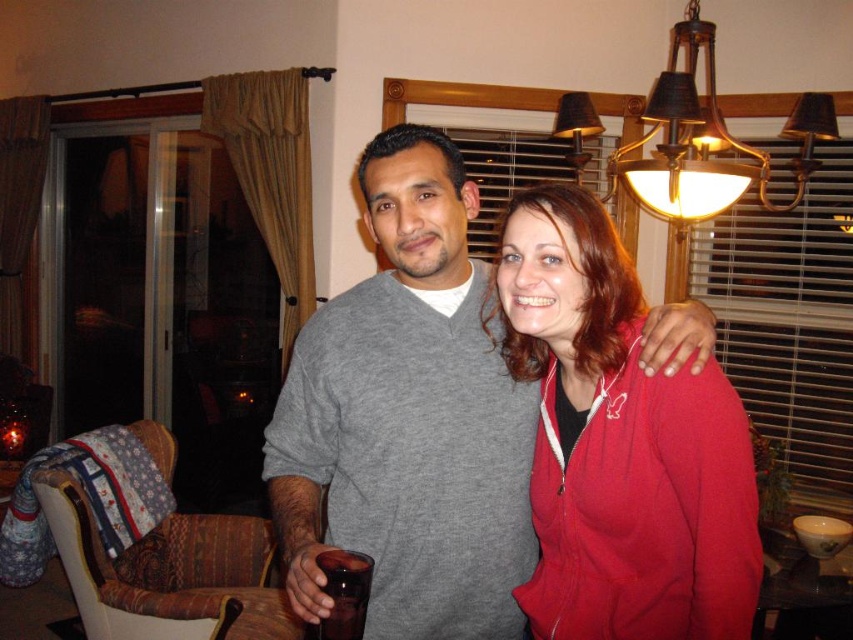
You are a delivery person standing in front of the gray matte sweater at center. The package you need to deliver must be placed exactly 3.5 feet away from the sweater. Can you place the package at the required distance?

The gray matte sweater at center is 3.49 feet from viewer, so placing the package exactly 3.5 feet away from it would require placing it approximately 0.01 feet beyond the sweater from the viewer perspective.